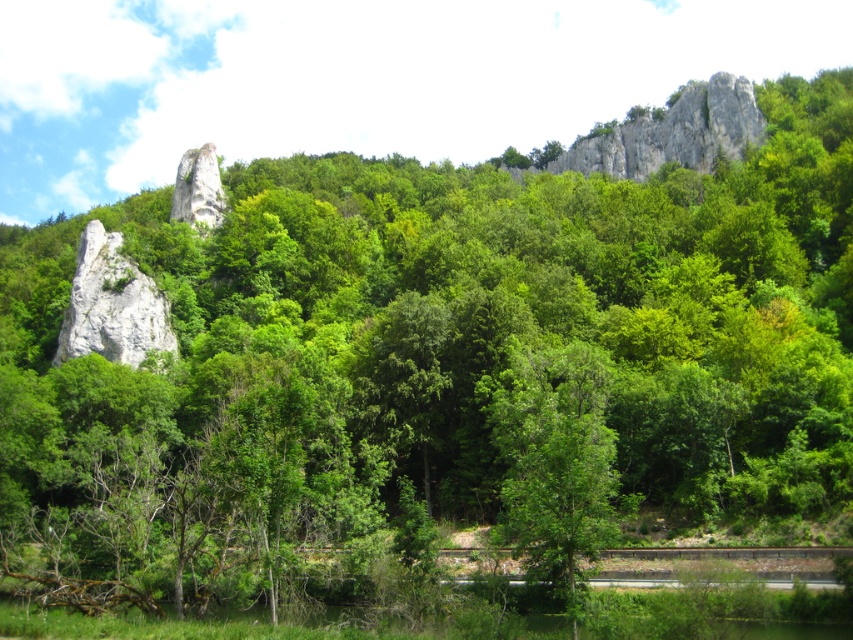
Question: Does white rock formation at upper center have a larger size compared to white rough rock at center?

Choices:
 (A) no
 (B) yes

Answer: (B)

Question: Does white rock formation at upper center have a larger size compared to white rough rock at center?

Choices:
 (A) no
 (B) yes

Answer: (B)

Question: Which of the following is the farthest from the observer?

Choices:
 (A) white rock formation at upper center
 (B) white rough rock at center

Answer: (A)

Question: Which point appears farthest from the camera in this image?

Choices:
 (A) (96, 282)
 (B) (213, 156)

Answer: (B)

Question: Can you confirm if white rock formation at upper center is wider than white rough rock at left?

Choices:
 (A) yes
 (B) no

Answer: (A)

Question: Which point is farther to the camera?

Choices:
 (A) (99, 337)
 (B) (187, 209)
 (C) (602, 161)

Answer: (C)